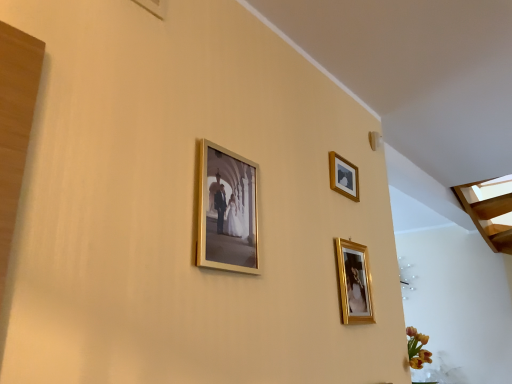
Question: Considering the relative positions of gold metallic photo frame at center, the first picture frame viewed from the front, and wooden picture frame at upper right, which is the first picture frame from back to front, in the image provided, is gold metallic photo frame at center, the first picture frame viewed from the front, to the right of wooden picture frame at upper right, which is the first picture frame from back to front, from the viewer's perspective?

Choices:
 (A) yes
 (B) no

Answer: (B)

Question: Does gold metallic photo frame at center, the first picture frame viewed from the front, come behind wooden picture frame at upper right, positioned as the 2th picture frame in right-to-left order?

Choices:
 (A) no
 (B) yes

Answer: (A)

Question: Could wooden picture frame at upper right, arranged as the third picture frame when viewed from the front, be considered to be inside gold metallic photo frame at center, acting as the third picture frame starting from the right?

Choices:
 (A) no
 (B) yes

Answer: (A)

Question: From the image's perspective, is gold metallic photo frame at center, acting as the third picture frame starting from the right, on wooden picture frame at upper right, the 2th picture frame when ordered from left to right?

Choices:
 (A) yes
 (B) no

Answer: (B)

Question: Can we say gold metallic photo frame at center, acting as the third picture frame starting from the right, lies outside wooden picture frame at upper right, which is the first picture frame from back to front?

Choices:
 (A) yes
 (B) no

Answer: (A)

Question: Is gold metallic photo frame at center, acting as the third picture frame starting from the right, situated inside wooden picture frame at upper right, which is the first picture frame from back to front, or outside?

Choices:
 (A) outside
 (B) inside

Answer: (A)

Question: Would you say gold metallic photo frame at center, arranged as the third picture frame when viewed from the back, is to the left or to the right of wooden picture frame at upper right, the 2th picture frame when ordered from left to right, in the picture?

Choices:
 (A) left
 (B) right

Answer: (A)

Question: Is point (236, 185) closer or farther from the camera than point (334, 172)?

Choices:
 (A) closer
 (B) farther

Answer: (A)

Question: From the image's perspective, is gold metallic photo frame at center, arranged as the third picture frame when viewed from the back, located above or below wooden picture frame at upper right, which is the first picture frame from back to front?

Choices:
 (A) below
 (B) above

Answer: (A)

Question: From a real-world perspective, is gold metallic picture frame at lower right, positioned as the third picture frame in left-to-right order, above or below gold metallic photo frame at center, acting as the third picture frame starting from the right?

Choices:
 (A) below
 (B) above

Answer: (A)

Question: Is gold metallic picture frame at lower right, which appears as the second picture frame when viewed from the back, bigger or smaller than gold metallic photo frame at center, the first picture frame viewed from the front?

Choices:
 (A) big
 (B) small

Answer: (B)

Question: Based on their positions, is gold metallic picture frame at lower right, which appears as the second picture frame when viewed from the back, located to the left or right of gold metallic photo frame at center, the first picture frame when ordered from left to right?

Choices:
 (A) left
 (B) right

Answer: (B)

Question: Considering their positions, is gold metallic picture frame at lower right, which is the first picture frame in right-to-left order, located in front of or behind gold metallic photo frame at center, the first picture frame viewed from the front?

Choices:
 (A) front
 (B) behind

Answer: (B)

Question: Considering their positions, is gold metallic photo frame at center, arranged as the third picture frame when viewed from the back, located in front of or behind gold metallic picture frame at lower right, which appears as the second picture frame when viewed from the back?

Choices:
 (A) behind
 (B) front

Answer: (B)

Question: From a real-world perspective, is gold metallic photo frame at center, the first picture frame viewed from the front, positioned above or below gold metallic picture frame at lower right, positioned as the third picture frame in left-to-right order?

Choices:
 (A) above
 (B) below

Answer: (A)